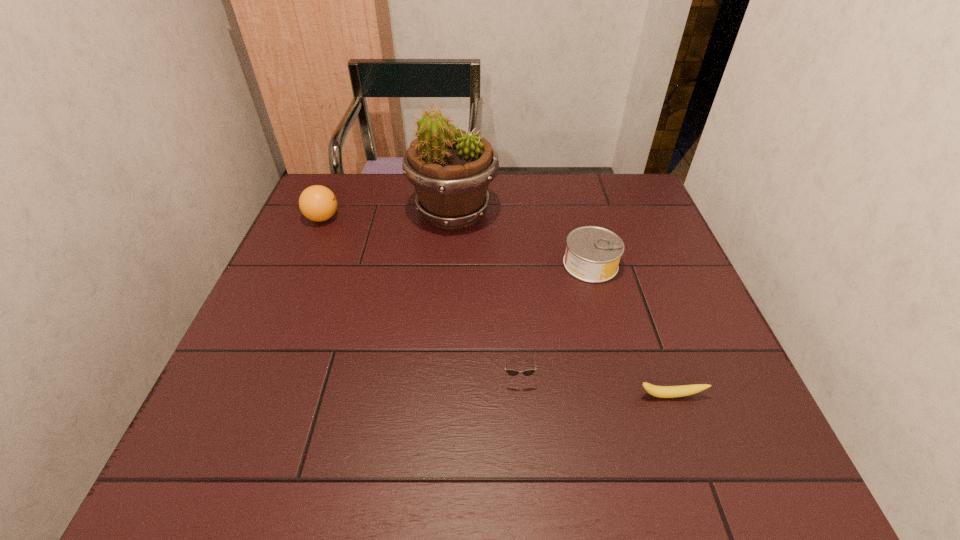
Locate an element on the screen. The height and width of the screenshot is (540, 960). vacant space at the left edge of the desktop is located at coordinates (333, 293).

The height and width of the screenshot is (540, 960). Identify the location of vacant space at the right edge. (649, 247).

The height and width of the screenshot is (540, 960). In the image, there is a desktop. What are the coordinates of `vacant region at the far left corner` in the screenshot? It's located at (350, 218).

The width and height of the screenshot is (960, 540). Identify the location of vacant space at the far right corner of the desktop. (609, 185).

Where is `free space at the near right corner`? The width and height of the screenshot is (960, 540). free space at the near right corner is located at coordinates (756, 464).

Locate an element on the screen. empty space between the leftmost object and the sunglasses is located at coordinates (420, 296).

Locate an element on the screen. This screenshot has height=540, width=960. empty location between the third farthest object and the banana is located at coordinates (630, 330).

Where is `vacant point located between the flowerpot and the can`? vacant point located between the flowerpot and the can is located at coordinates click(x=522, y=238).

Identify the location of free space between the shortest object and the leftmost object. This screenshot has height=540, width=960. (496, 307).

The image size is (960, 540). In order to click on vacant space that's between the can and the leftmost object in this screenshot , I will do (x=457, y=241).